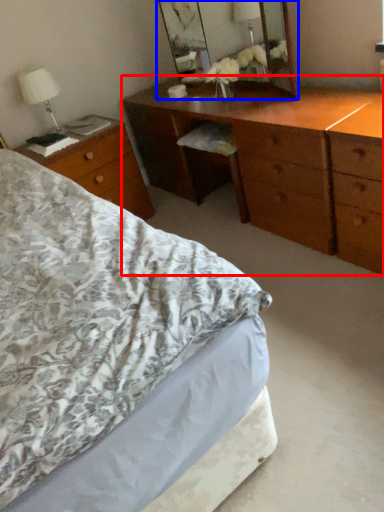
Question: Which object appears closest to the camera in this image, chest of drawers (highlighted by a red box) or mirror (highlighted by a blue box)?

Choices:
 (A) chest of drawers
 (B) mirror

Answer: (A)